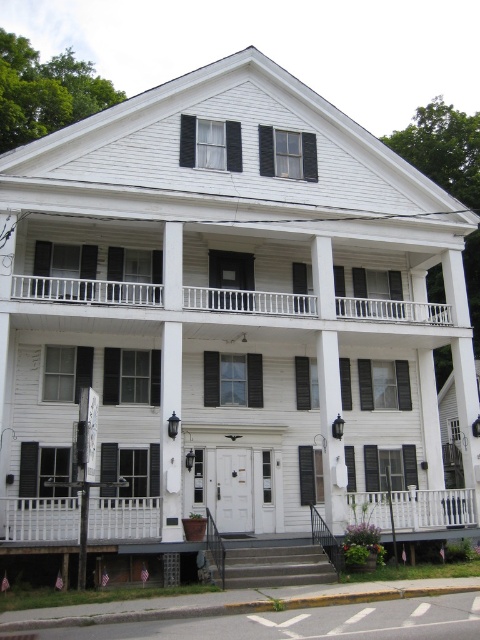
Question: Does white wooden porch at upper center appear over black wood shutter at center?

Choices:
 (A) no
 (B) yes

Answer: (B)

Question: Which point is farther to the camera?

Choices:
 (A) (288, 301)
 (B) (19, 508)

Answer: (A)

Question: Based on their relative distances, which object is farther from the black wood shutter at center?

Choices:
 (A) white wooden porch at upper center
 (B) white painted wood balustrade at lower center

Answer: (A)

Question: Which point is farther from the camera taking this photo?

Choices:
 (A) (100, 474)
 (B) (394, 304)

Answer: (B)

Question: Can you confirm if white painted wood balustrade at lower center is positioned to the left of black wood shutter at center?

Choices:
 (A) no
 (B) yes

Answer: (B)

Question: Is white wooden porch at upper center positioned at the back of white painted wood balustrade at lower center?

Choices:
 (A) yes
 (B) no

Answer: (A)